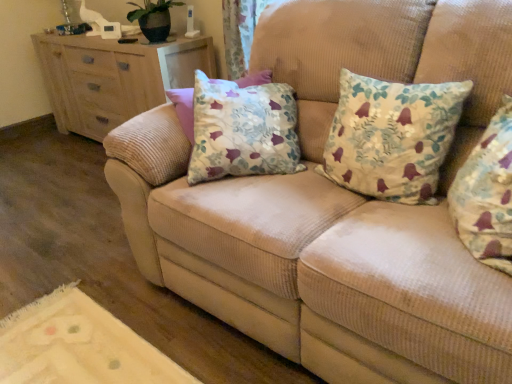
Question: Is wooden chest of drawers at left positioned with its back to floral fabric cushion at center, which is the 1th pillow from front to back?

Choices:
 (A) yes
 (B) no

Answer: (B)

Question: Considering the relative sizes of wooden chest of drawers at left and floral fabric cushion at center, placed as the second pillow when sorted from back to front, in the image provided, is wooden chest of drawers at left smaller than floral fabric cushion at center, placed as the second pillow when sorted from back to front,?

Choices:
 (A) no
 (B) yes

Answer: (A)

Question: Considering the relative positions of wooden chest of drawers at left and floral fabric cushion at center, placed as the second pillow when sorted from back to front, in the image provided, is wooden chest of drawers at left to the right of floral fabric cushion at center, placed as the second pillow when sorted from back to front, from the viewer's perspective?

Choices:
 (A) no
 (B) yes

Answer: (A)

Question: Is wooden chest of drawers at left thinner than floral fabric cushion at center, which is the 1th pillow from front to back?

Choices:
 (A) yes
 (B) no

Answer: (B)

Question: Is wooden chest of drawers at left at the left side of floral fabric cushion at center, placed as the second pillow when sorted from back to front?

Choices:
 (A) yes
 (B) no

Answer: (A)

Question: Considering the relative sizes of wooden chest of drawers at left and floral fabric cushion at center, placed as the second pillow when sorted from back to front, in the image provided, is wooden chest of drawers at left wider than floral fabric cushion at center, placed as the second pillow when sorted from back to front,?

Choices:
 (A) no
 (B) yes

Answer: (B)

Question: Is wooden chest of drawers at left further to camera compared to floral fabric pillow at center, arranged as the first pillow when viewed from the back?

Choices:
 (A) yes
 (B) no

Answer: (A)

Question: Is wooden chest of drawers at left taller than floral fabric pillow at center, the second pillow positioned from the front?

Choices:
 (A) yes
 (B) no

Answer: (A)

Question: Is wooden chest of drawers at left not inside floral fabric pillow at center, arranged as the first pillow when viewed from the back?

Choices:
 (A) yes
 (B) no

Answer: (A)

Question: Is wooden chest of drawers at left to the left of floral fabric pillow at center, the second pillow positioned from the front, from the viewer's perspective?

Choices:
 (A) no
 (B) yes

Answer: (B)

Question: Does wooden chest of drawers at left lie in front of floral fabric pillow at center, the second pillow positioned from the front?

Choices:
 (A) yes
 (B) no

Answer: (B)

Question: From the image's perspective, is wooden chest of drawers at left over floral fabric pillow at center, arranged as the first pillow when viewed from the back?

Choices:
 (A) no
 (B) yes

Answer: (B)

Question: Considering the relative sizes of floral fabric pillow at center, the second pillow positioned from the front, and floral fabric cushion at center, which is the 1th pillow from front to back, in the image provided, is floral fabric pillow at center, the second pillow positioned from the front, shorter than floral fabric cushion at center, which is the 1th pillow from front to back,?

Choices:
 (A) yes
 (B) no

Answer: (A)